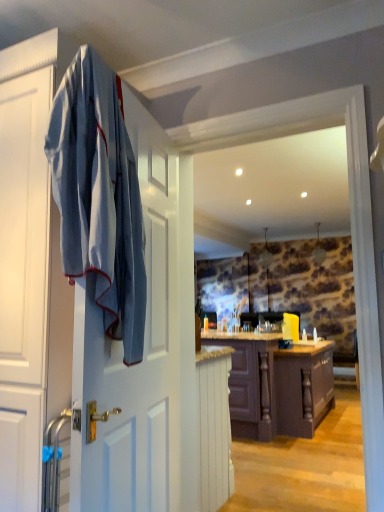
Question: Is dark wood cabinet at center, the 1th cabinetry in the back-to-front sequence, bigger or smaller than blue cotton bath towel at left?

Choices:
 (A) big
 (B) small

Answer: (A)

Question: From the image's perspective, is dark wood cabinet at center, the 1th cabinetry when ordered from right to left, positioned above or below blue cotton bath towel at left?

Choices:
 (A) above
 (B) below

Answer: (B)

Question: Which is nearer to the white painted wood cabinet at lower center, the 1th cabinetry from the front?

Choices:
 (A) dark wood cabinet at center, marked as the 2th cabinetry in a front-to-back arrangement
 (B) blue cotton bath towel at left

Answer: (A)

Question: Which object is the farthest from the white painted wood cabinet at lower center, the first cabinetry when ordered from left to right?

Choices:
 (A) dark wood cabinet at center, the second cabinetry positioned from the left
 (B) blue cotton bath towel at left

Answer: (B)